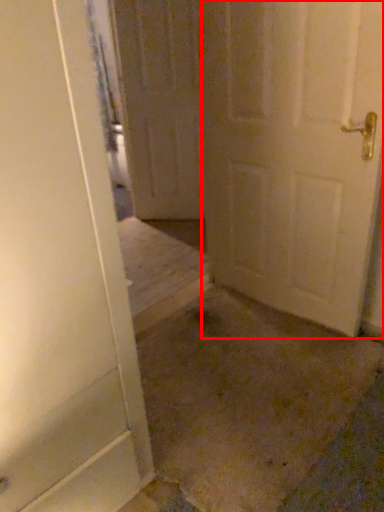
Question: In this image, where is door (annotated by the red box) located relative to door?

Choices:
 (A) left
 (B) right

Answer: (B)